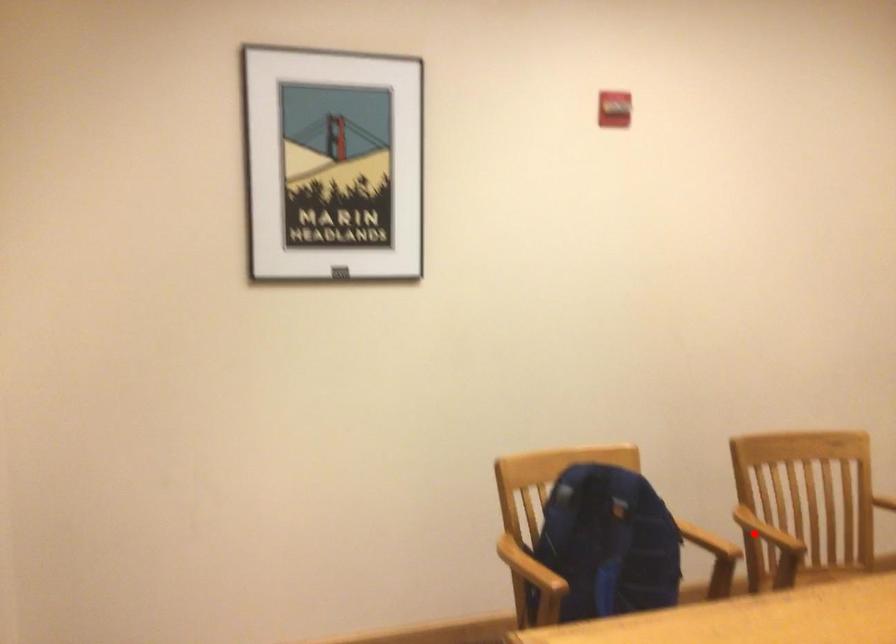
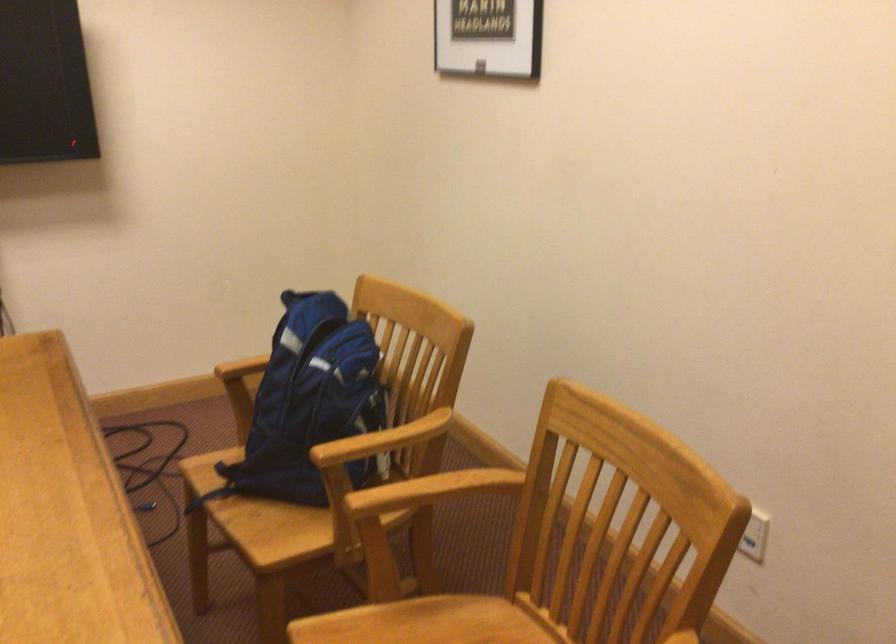
Question: I am providing you with two images of the same scene from different viewpoints. Image1 has a red point marked. In image2, the corresponding 3D location appears at what relative position? Reply with the corresponding letter.

Choices:
 (A) Closer
 (B) Farther

Answer: (A)